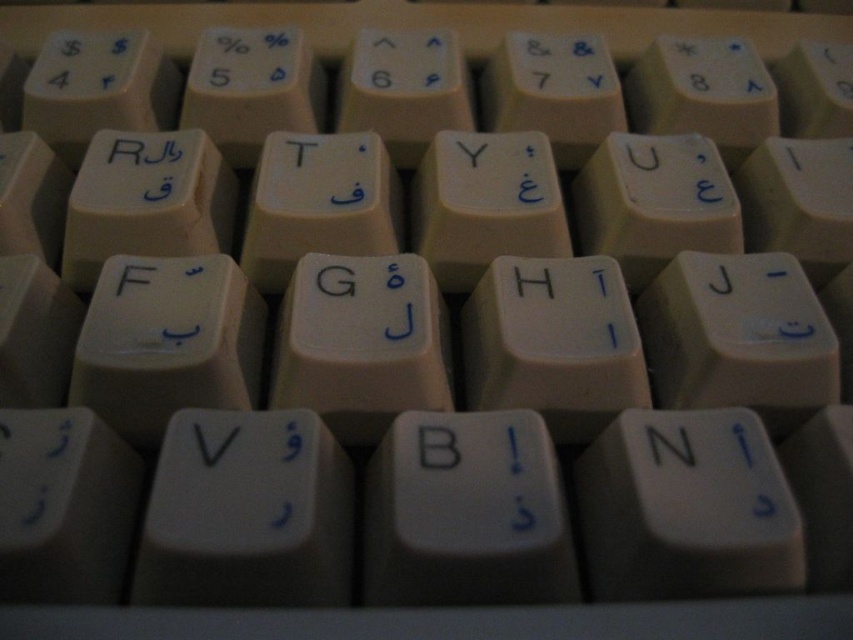
You are using a keyboard with both English and Arabic characters. You need to press the black plastic letter v at center. What are the coordinates of the key you should press?

The coordinates of the black plastic letter v at center are at point (x=213, y=444).